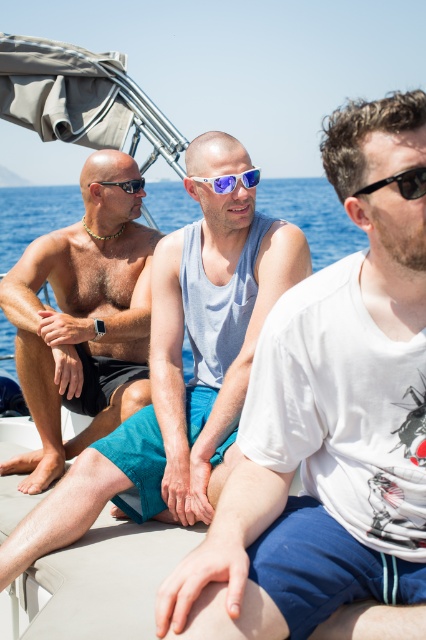
Question: Does blue reflective lenses at center appear on the left side of matte black sunglasses at left?

Choices:
 (A) no
 (B) yes

Answer: (A)

Question: Which point appears closest to the camera in this image?

Choices:
 (A) [365, 186]
 (B) [216, 461]

Answer: (A)

Question: Is white cotton tank top at center to the left of matte black sunglasses at left from the viewer's perspective?

Choices:
 (A) yes
 (B) no

Answer: (B)

Question: Which point is farther from the camera taking this photo?

Choices:
 (A) (195, 177)
 (B) (420, 189)
 (C) (135, 188)

Answer: (C)

Question: Based on their relative distances, which object is nearer to the bare chested torso at center?

Choices:
 (A) black plastic sunglasses at right
 (B) blue reflective lenses at center
 (C) gray fabric tank top at center

Answer: (C)

Question: Does bare chested torso at center have a greater width compared to blue reflective lenses at center?

Choices:
 (A) no
 (B) yes

Answer: (A)